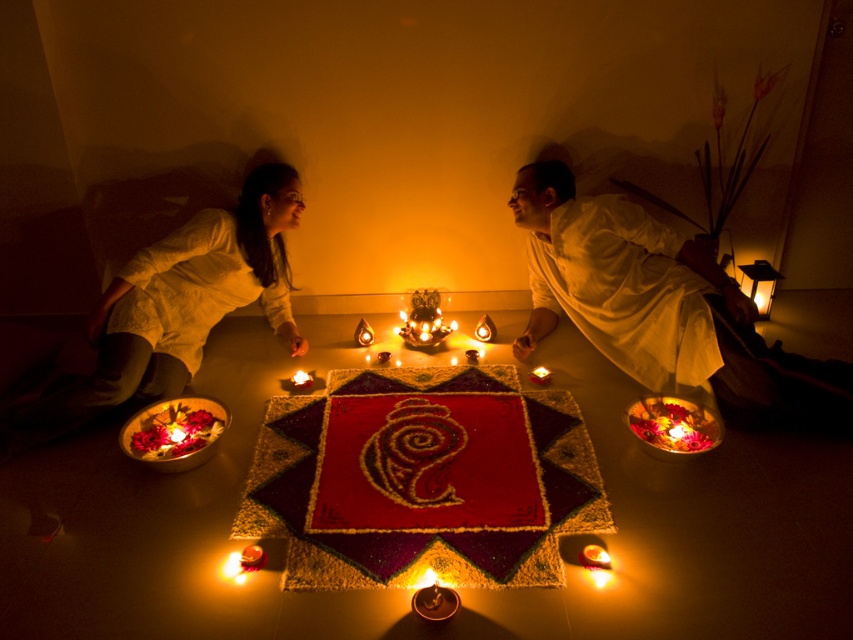
You are planning to place a new decorative item in the center of the scene. The item is 1.2 meters tall. Considering the white cotton man at center and the matte glass candle at center, will there be enough space for the new item without overlapping them?

The white cotton man at center is larger than the matte glass candle at center. However, since the new item is 1.2 meters tall, it might require checking the vertical space availability. The scene description mentions the ambiance is created by numerous small candles and oil lamps, but there is no specific height constraint mentioned. Assuming the central area has enough vertical clearance, the new item could be placed there, but it depends on the existing objects not being too close horizontally. Since the